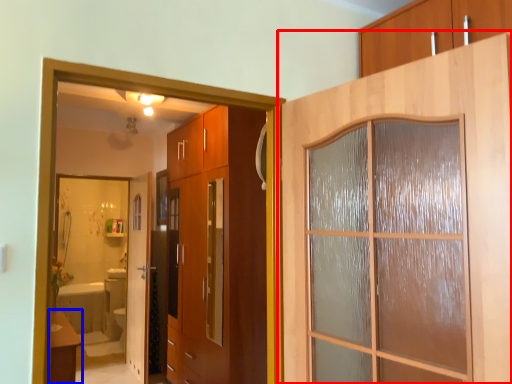
Question: Which object appears closest to the camera in this image, door (highlighted by a red box) or table (highlighted by a blue box)?

Choices:
 (A) door
 (B) table

Answer: (A)